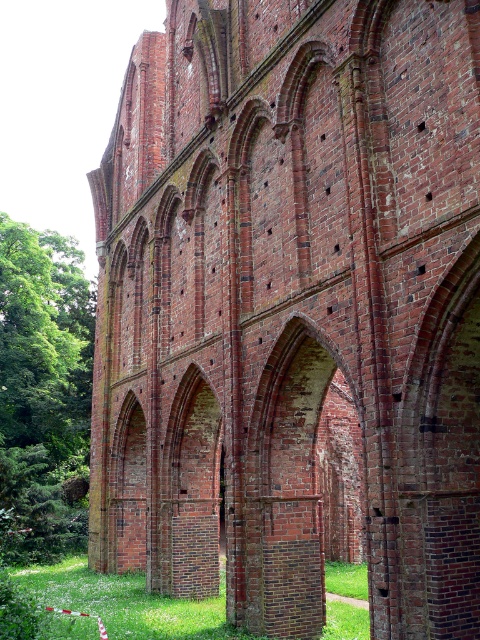
You are standing in front of the historic brick structure and notice the green leafy tree at left and the green grass at lower center. Which of these two is closer to you?

The green leafy tree at left is closer to you because the green grass at lower center is behind it.

You are standing in front of the historic brick structure and want to take a photo that includes both the green leafy tree at left and the green grass at lower center. Which object will appear bigger in the photo?

The green leafy tree at left will appear bigger in the photo because it has a larger size compared to the green grass at lower center.

You are standing in front of the historic brick structure. Where is the green leafy tree at left located in relation to the arches?

The green leafy tree at left is located at point (44, 392), which is to the left side of the arches.